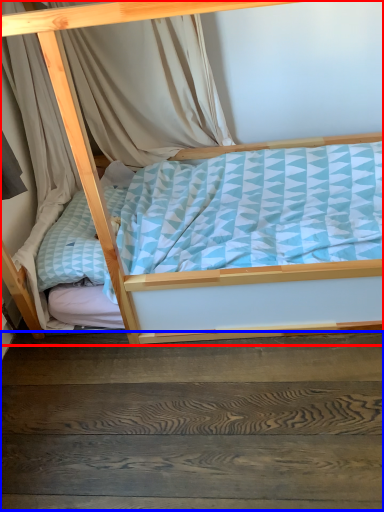
Question: Which point is further to the camera, bed (highlighted by a red box) or stairwell (highlighted by a blue box)?

Choices:
 (A) bed
 (B) stairwell

Answer: (B)